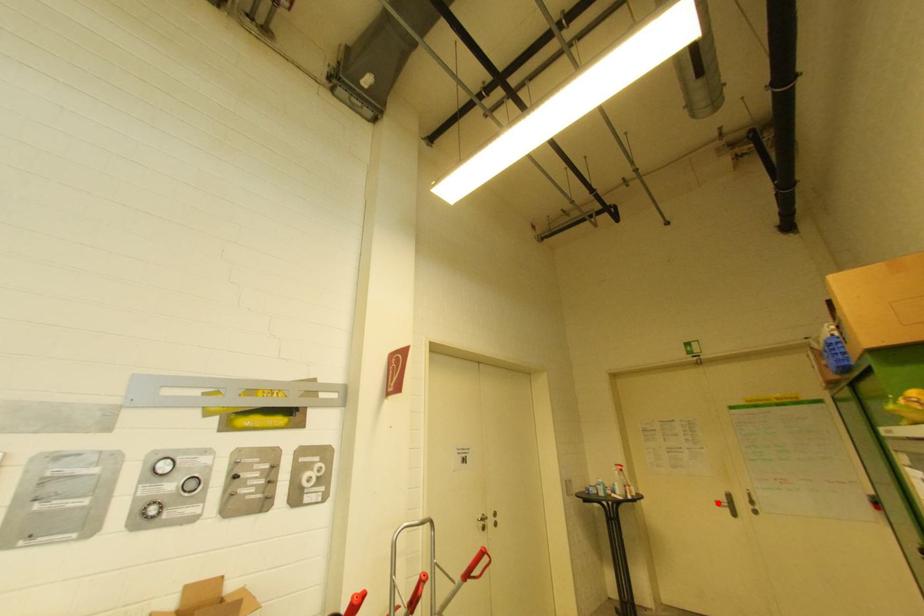
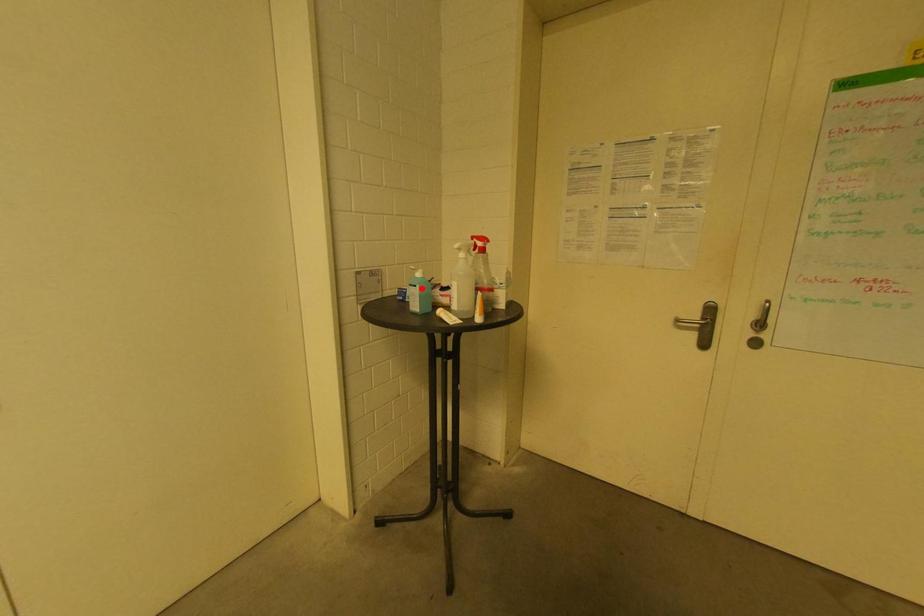
I am providing you with two images of the same scene from different viewpoints. A red point is marked on the first image and another point is marked on the second image. Are the points marked in image1 and image2 representing the same 3D position?

No